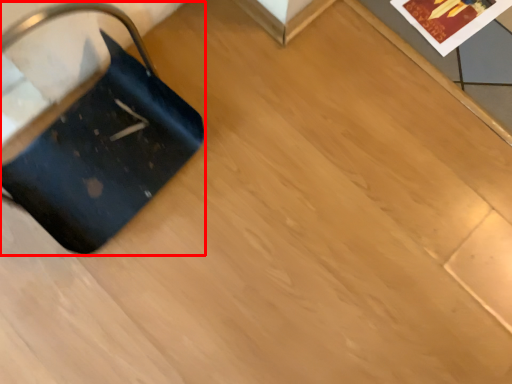
Question: Where is luggage (annotated by the red box) located in relation to postcard in the image?

Choices:
 (A) right
 (B) left

Answer: (B)